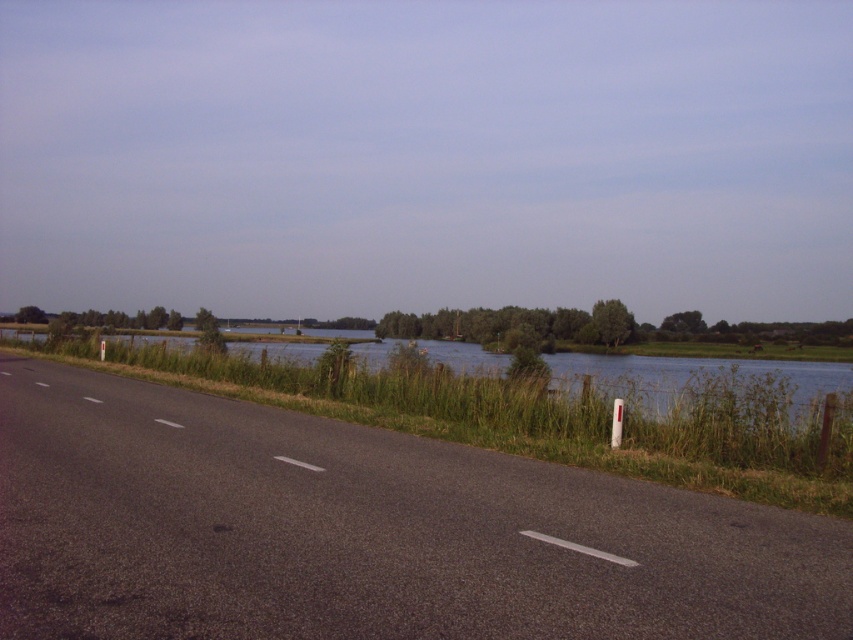
Is black asphalt highway at center to the right of green grassy river at center from the viewer's perspective?

Incorrect, black asphalt highway at center is not on the right side of green grassy river at center.

You are a GUI agent. You are given a task and a screenshot of the screen. Output one action in this format:
    pyautogui.click(x=<x>, y=<y>)
    Task: Click on the black asphalt highway at center
    The width and height of the screenshot is (853, 640).
    Given the screenshot: What is the action you would take?
    pyautogui.click(x=364, y=531)

What do you see at coordinates (364, 531) in the screenshot? The image size is (853, 640). I see `black asphalt highway at center` at bounding box center [364, 531].

This screenshot has height=640, width=853. In order to click on black asphalt highway at center in this screenshot , I will do `click(364, 531)`.